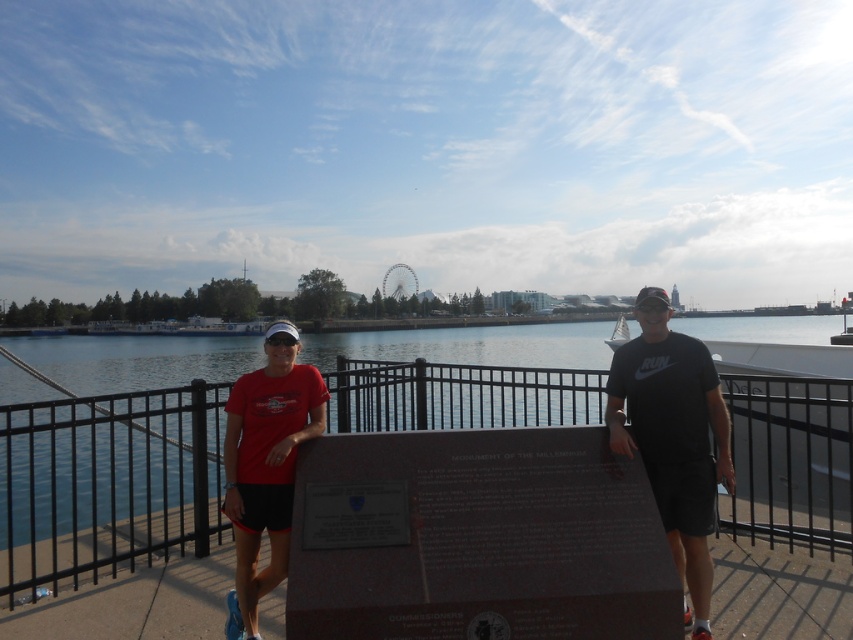
Question: Is black metal fence at center smaller than black matte t-shirt at center?

Choices:
 (A) yes
 (B) no

Answer: (B)

Question: Is black matte t-shirt at center closer to the viewer compared to matte red shirt at center?

Choices:
 (A) yes
 (B) no

Answer: (A)

Question: Which object appears closest to the camera in this image?

Choices:
 (A) black metal fence at center
 (B) matte red shirt at center
 (C) black matte t-shirt at center

Answer: (C)

Question: Among these points, which one is nearest to the camera?

Choices:
 (A) (650, 456)
 (B) (300, 397)

Answer: (A)

Question: Can you confirm if black metal fence at center is positioned to the left of matte red shirt at center?

Choices:
 (A) no
 (B) yes

Answer: (A)

Question: Which of these objects is positioned closest to the matte red shirt at center?

Choices:
 (A) black metal fence at center
 (B) black matte t-shirt at center

Answer: (B)